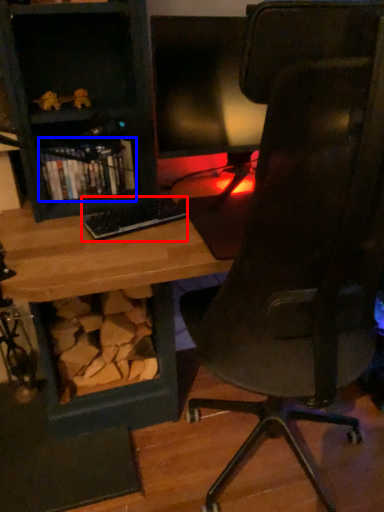
Question: Which point is further to the camera, keyboard (highlighted by a red box) or book (highlighted by a blue box)?

Choices:
 (A) keyboard
 (B) book

Answer: (B)